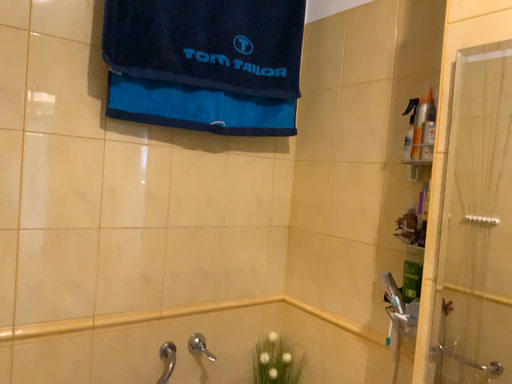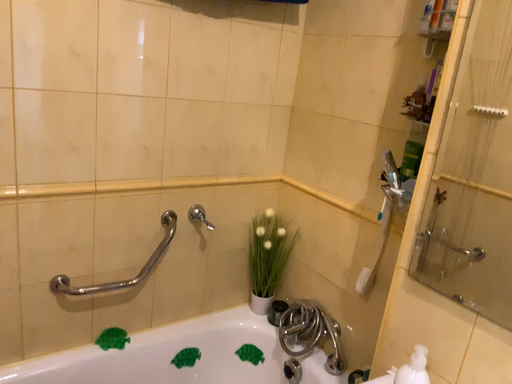
Question: Which way did the camera rotate in the video?

Choices:
 (A) rotated downward
 (B) rotated upward

Answer: (A)